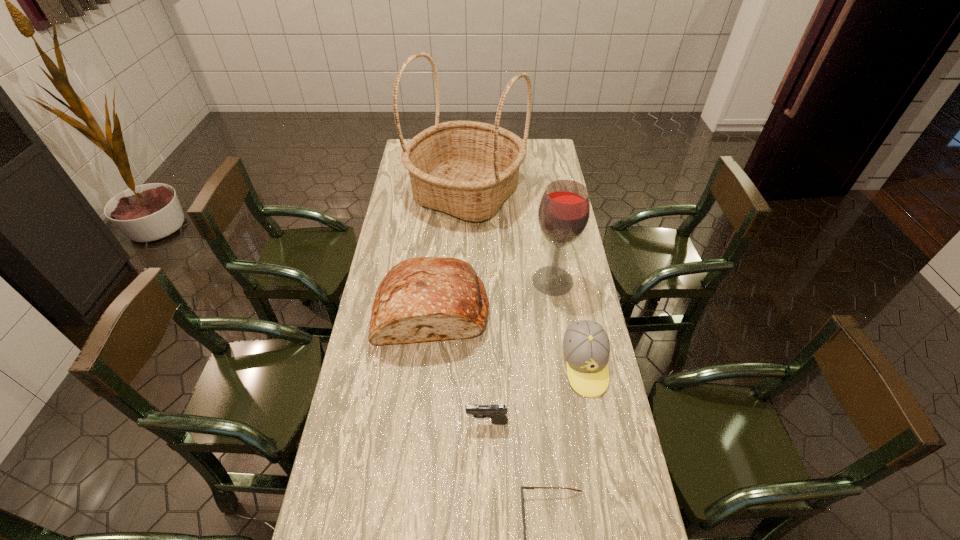
The width and height of the screenshot is (960, 540). I want to click on vacant space at the left edge of the desktop, so click(378, 532).

Locate an element on the screen. The width and height of the screenshot is (960, 540). free spot at the right edge of the desktop is located at coordinates (612, 434).

The height and width of the screenshot is (540, 960). Find the location of `vacant space that's between the alcohol and the farthest object`. vacant space that's between the alcohol and the farthest object is located at coordinates (509, 237).

The width and height of the screenshot is (960, 540). I want to click on free space between the bread and the tallest object, so click(x=449, y=251).

The width and height of the screenshot is (960, 540). I want to click on free space between the second tallest object and the bread, so click(x=492, y=295).

I want to click on free space between the third shortest object and the tallest object, so click(525, 280).

This screenshot has height=540, width=960. I want to click on free space between the farthest object and the third tallest object, so click(x=449, y=251).

Identify the location of vacant area that lies between the pistol and the fourth shortest object. coord(460,365).

In order to click on free space between the baseball cap and the pistol in this screenshot , I will do 536,394.

Where is `vacant area that lies between the basket and the alcohol`? The height and width of the screenshot is (540, 960). vacant area that lies between the basket and the alcohol is located at coordinates (509, 237).